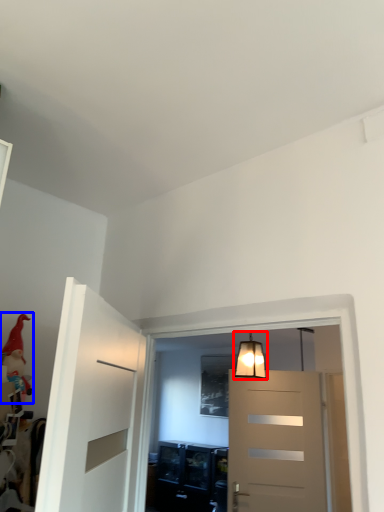
Question: Which object is closer to the camera taking this photo, lamp (highlighted by a red box) or toy (highlighted by a blue box)?

Choices:
 (A) lamp
 (B) toy

Answer: (B)